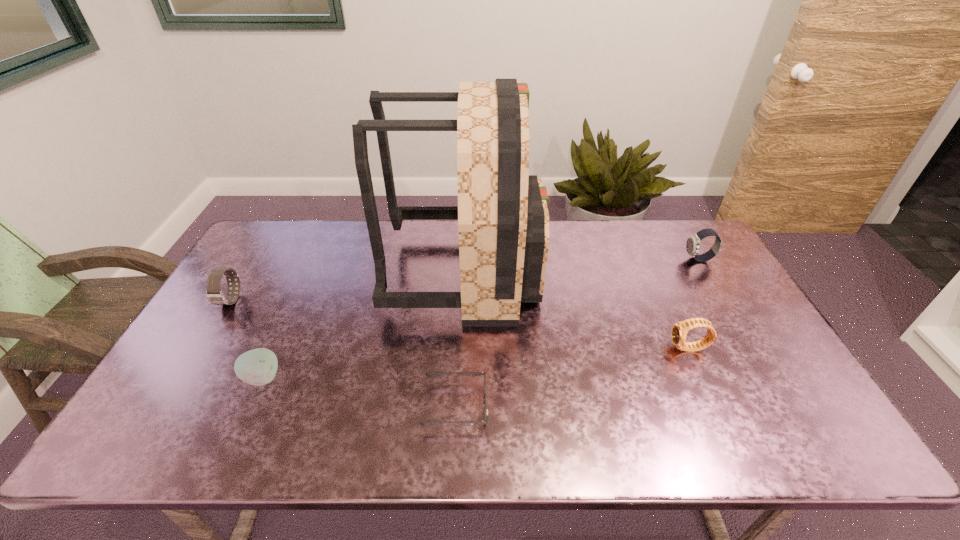
At what (x,y) coordinates should I click in order to perform the action: click on backpack. Please return your answer as a coordinate pair (x, y). Image resolution: width=960 pixels, height=540 pixels. Looking at the image, I should click on (503, 221).

Image resolution: width=960 pixels, height=540 pixels. I want to click on the farthest watch, so click(693, 242).

Identify the location of the rightmost object. The height and width of the screenshot is (540, 960). (693, 242).

This screenshot has width=960, height=540. What are the coordinates of `the second farthest watch` in the screenshot? It's located at (214, 294).

Identify the location of the leftmost watch. (214, 294).

Find the location of a particular element. Image resolution: width=960 pixels, height=540 pixels. the second object from right to left is located at coordinates (679, 331).

Where is `the nearest watch`? the nearest watch is located at coordinates (679, 331).

You are a GUI agent. You are given a task and a screenshot of the screen. Output one action in this format:
    pyautogui.click(x=<x>, y=<y>)
    Task: Click on the fifth object from right to left
    This screenshot has width=960, height=540.
    Given the screenshot: What is the action you would take?
    pyautogui.click(x=257, y=367)

Image resolution: width=960 pixels, height=540 pixels. I want to click on the shortest object, so click(426, 423).

I want to click on vacant space situated on the front face of the tallest object, so click(579, 272).